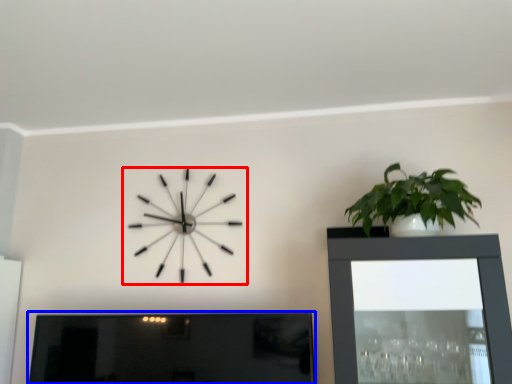
Question: Which object is further to the camera taking this photo, wall clock (highlighted by a red box) or picture frame (highlighted by a blue box)?

Choices:
 (A) wall clock
 (B) picture frame

Answer: (A)